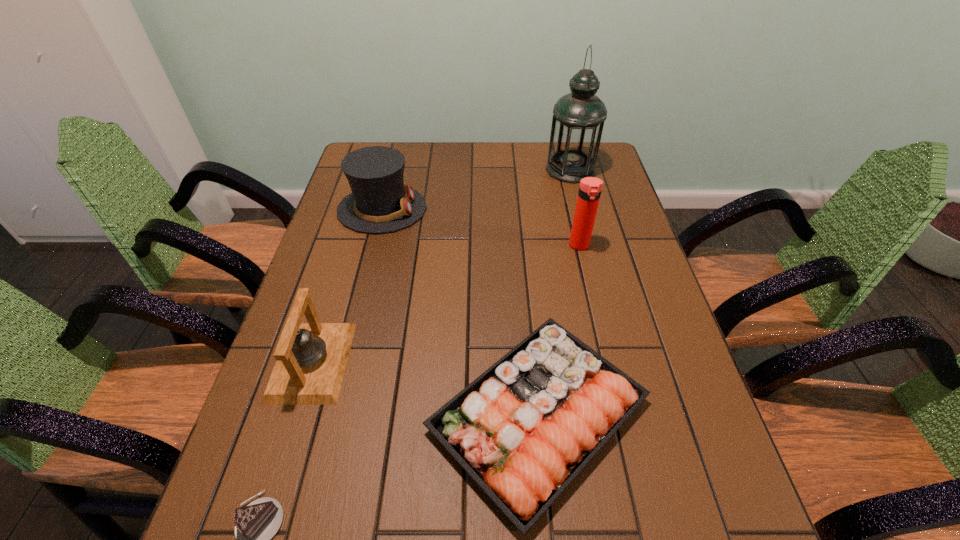
The width and height of the screenshot is (960, 540). Identify the location of oil lamp. (578, 118).

Locate an element on the screen. Image resolution: width=960 pixels, height=540 pixels. the tallest object is located at coordinates (578, 118).

Where is `the second tallest object`? The height and width of the screenshot is (540, 960). the second tallest object is located at coordinates pyautogui.click(x=590, y=188).

The image size is (960, 540). Identify the location of thermos bottle. (590, 188).

Identify the location of dress hat. (379, 203).

This screenshot has width=960, height=540. In order to click on bell in this screenshot , I will do `click(311, 358)`.

This screenshot has height=540, width=960. What are the coordinates of `free space located 0.390m on the front of the oil lamp` in the screenshot? It's located at (595, 266).

At what (x,y) coordinates should I click in order to perform the action: click on free location located 0.400m on the left of the second tallest object. Please return your answer as a coordinate pair (x, y). Image resolution: width=960 pixels, height=540 pixels. Looking at the image, I should click on (429, 246).

Locate an element on the screen. The width and height of the screenshot is (960, 540). vacant space located with goggles on the front of the dress hat is located at coordinates (523, 209).

Where is `vacant space located 0.220m on the right of the bell`? vacant space located 0.220m on the right of the bell is located at coordinates (445, 361).